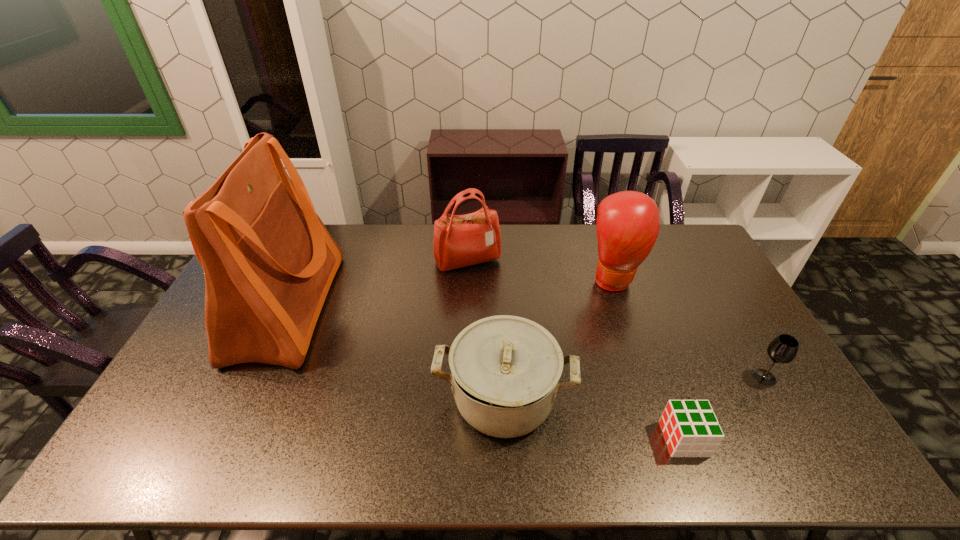
Where is `cube that is at the near edge`? Image resolution: width=960 pixels, height=540 pixels. cube that is at the near edge is located at coordinates (690, 428).

Locate an element on the screen. object present at the left edge is located at coordinates (268, 260).

Find the location of a particular element. Image resolution: width=960 pixels, height=540 pixels. object at the right edge is located at coordinates (783, 349).

The height and width of the screenshot is (540, 960). I want to click on object present at the far left corner, so click(268, 260).

In the image, there is a desktop. Identify the location of vacant region at the far edge. This screenshot has height=540, width=960. (423, 247).

Identify the location of vacant area at the near edge of the desktop. (238, 456).

In the image, there is a desktop. What are the coordinates of `free space at the left edge` in the screenshot? It's located at (213, 392).

I want to click on free region at the right edge, so click(x=758, y=362).

Image resolution: width=960 pixels, height=540 pixels. In order to click on free space at the far right corner in this screenshot , I will do `click(665, 241)`.

The height and width of the screenshot is (540, 960). I want to click on vacant space in between the boxing glove and the saucepan, so click(559, 339).